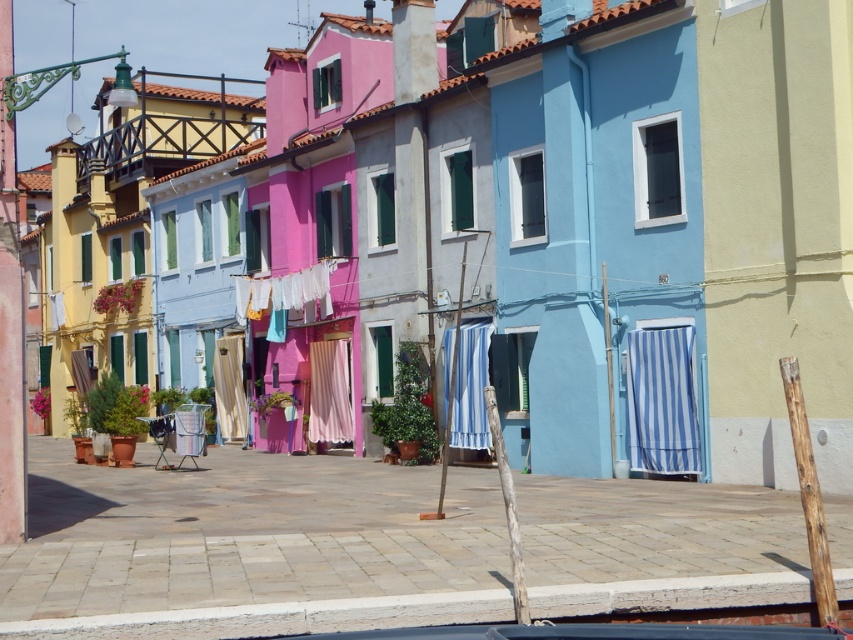
You are standing at the center of the street looking towards the houses. Where is the blue striped fabric at lower right located in terms of its position relative to the center of the image?

The blue striped fabric at lower right is located at the lower right of the image, specifically at the 2D coordinate point of (662, 401).

You are a delivery person trying to navigate through the street. There are two items hanging at the center of the street. The blue striped fabric at center and the matte beige curtain at center. Which one is lower and might pose a lower obstacle for your delivery cart?

The blue striped fabric at center is shorter than the matte beige curtain at center, so it is lower and would pose a lower obstacle for your delivery cart.